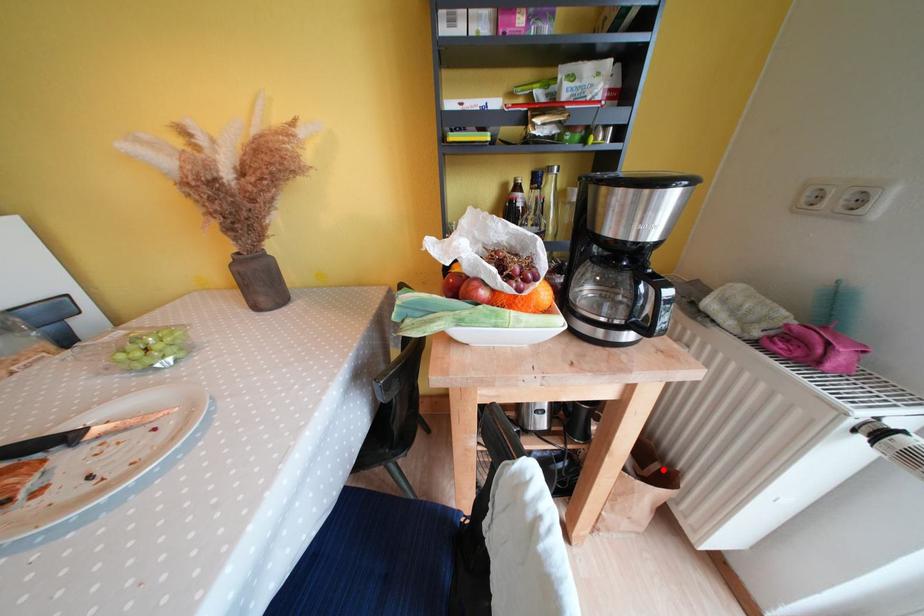
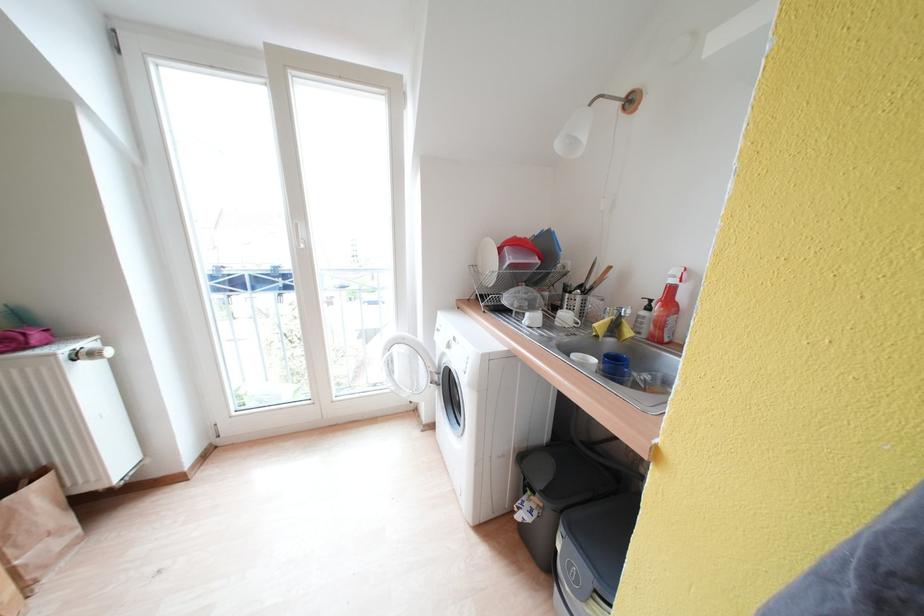
Question: I am providing you with two images of the same scene from different viewpoints. In image1, a red point is highlighted. Considering the same 3D point in image2, which of the following is correct?

Choices:
 (A) It is closer
 (B) It is farther

Answer: (B)